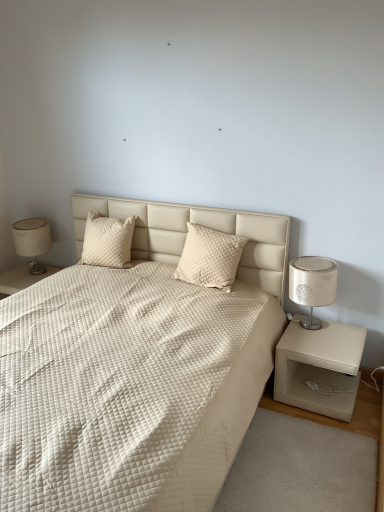
Question: Would you say matte beige lampshade at left is a long distance from cream quilted pillow at center, placed as the 1th pillow when sorted from right to left?

Choices:
 (A) no
 (B) yes

Answer: (B)

Question: Can you confirm if matte beige lampshade at left is positioned to the right of cream quilted pillow at center, placed as the 1th pillow when sorted from right to left?

Choices:
 (A) yes
 (B) no

Answer: (B)

Question: From the image's perspective, is matte beige lampshade at left over cream quilted pillow at center, which is counted as the 2th pillow, starting from the left?

Choices:
 (A) no
 (B) yes

Answer: (B)

Question: Considering the relative sizes of matte beige lampshade at left and cream quilted pillow at center, which is counted as the 2th pillow, starting from the left, in the image provided, is matte beige lampshade at left taller than cream quilted pillow at center, which is counted as the 2th pillow, starting from the left,?

Choices:
 (A) no
 (B) yes

Answer: (B)

Question: Is matte beige lampshade at left smaller than cream quilted pillow at center, placed as the 1th pillow when sorted from right to left?

Choices:
 (A) no
 (B) yes

Answer: (A)

Question: From a real-world perspective, is matte beige lampshade at left beneath cream quilted pillow at center, which is counted as the 2th pillow, starting from the left?

Choices:
 (A) yes
 (B) no

Answer: (A)

Question: Is quilted cream pillow at upper left, the 1th pillow viewed from the left, not close to white quilted fabric bed at center?

Choices:
 (A) no
 (B) yes

Answer: (A)

Question: Does quilted cream pillow at upper left, the 1th pillow viewed from the left, have a greater height compared to white quilted fabric bed at center?

Choices:
 (A) no
 (B) yes

Answer: (A)

Question: Does quilted cream pillow at upper left, which is the second pillow in right-to-left order, appear on the left side of white quilted fabric bed at center?

Choices:
 (A) yes
 (B) no

Answer: (A)

Question: Is white quilted fabric bed at center a part of quilted cream pillow at upper left, the 1th pillow viewed from the left?

Choices:
 (A) yes
 (B) no

Answer: (B)

Question: Is quilted cream pillow at upper left, the 1th pillow viewed from the left, positioned with its back to white quilted fabric bed at center?

Choices:
 (A) no
 (B) yes

Answer: (B)

Question: Does quilted cream pillow at upper left, the 1th pillow viewed from the left, lie behind white quilted fabric bed at center?

Choices:
 (A) no
 (B) yes

Answer: (B)

Question: From the image's perspective, is white quilted fabric bed at center located above cream quilted pillow at center, which is counted as the 2th pillow, starting from the left?

Choices:
 (A) no
 (B) yes

Answer: (A)